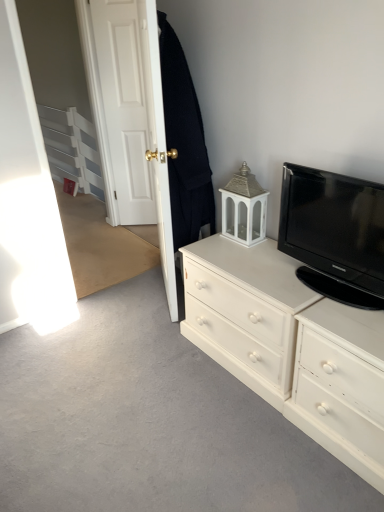
Identify the location of blank space situated above white painted wood drawer at right (from a real-world perspective). (349, 320).